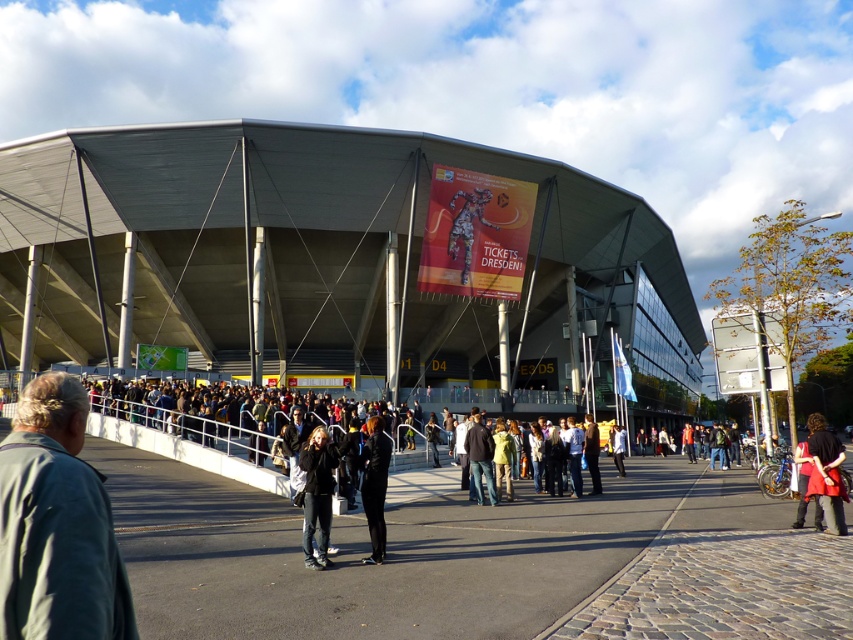
Is jeans at center bigger than dark brown leather jacket at center?

Actually, jeans at center might be smaller than dark brown leather jacket at center.

Who is more distant from viewer, (474, 412) or (595, 452)?

The point (595, 452) is behind.

Image resolution: width=853 pixels, height=640 pixels. What do you see at coordinates (480, 458) in the screenshot?
I see `jeans at center` at bounding box center [480, 458].

At what (x,y) coordinates should I click in order to perform the action: click on jeans at center. Please return your answer as a coordinate pair (x, y). The image size is (853, 640). Looking at the image, I should click on (480, 458).

Does gray metallic stadium at center have a larger size compared to black fabric pants at center?

Yes.

Can you confirm if gray metallic stadium at center is thinner than black fabric pants at center?

No, gray metallic stadium at center is not thinner than black fabric pants at center.

Measure the distance between point (42,202) and camera.

A distance of 43.64 meters exists between point (42,202) and camera.

Find the location of a particular element. Image resolution: width=853 pixels, height=640 pixels. gray metallic stadium at center is located at coordinates (343, 264).

Which is behind, point (314, 429) or point (596, 433)?

The point (596, 433) is more distant.

Is dark gray hoodie at center behind dark brown leather jacket at center?

No, dark gray hoodie at center is in front of dark brown leather jacket at center.

The height and width of the screenshot is (640, 853). Find the location of `dark gray hoodie at center`. dark gray hoodie at center is located at coordinates (317, 492).